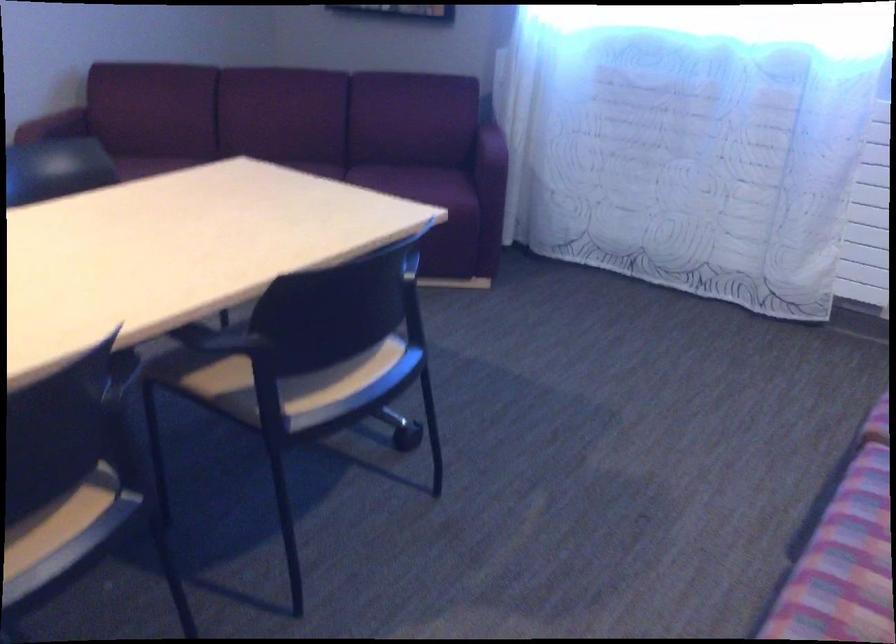
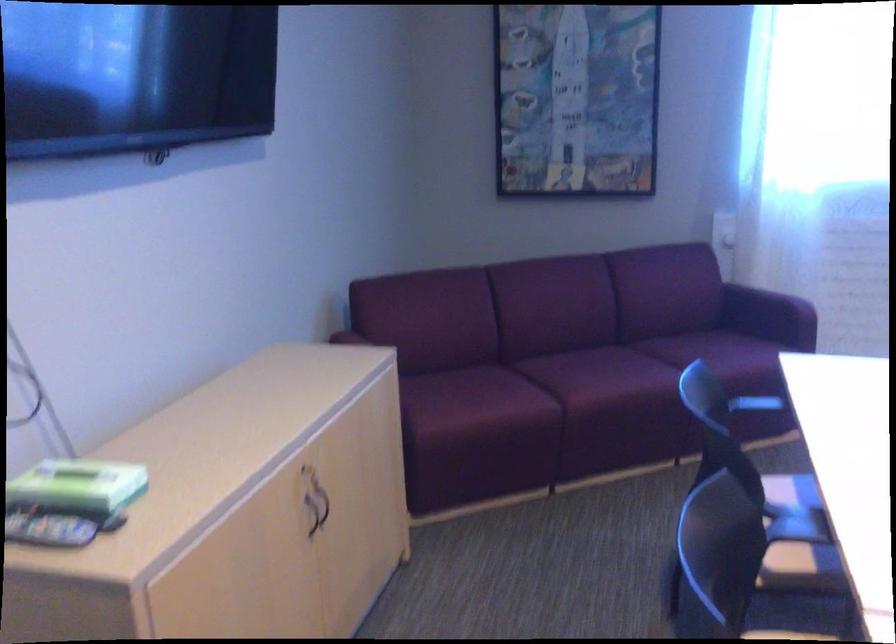
Question: What movement of the cameraman would produce the second image?

Choices:
 (A) Left
 (B) Right
 (C) Forward
 (D) Backward

Answer: (A)